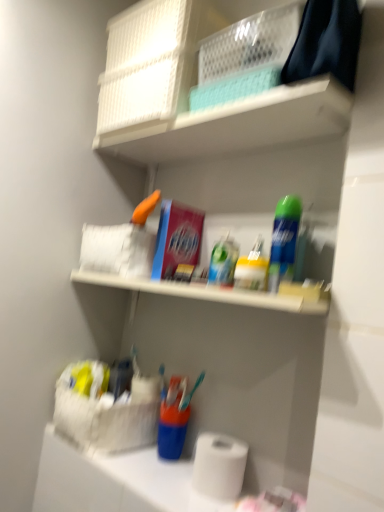
Question: Considering the relative sizes of white matte toilet paper at lower center and translucent plastic container at center, which is the second toiletry from left to right, in the image provided, is white matte toilet paper at lower center thinner than translucent plastic container at center, which is the second toiletry from left to right,?

Choices:
 (A) no
 (B) yes

Answer: (A)

Question: Can you confirm if white matte toilet paper at lower center is bigger than translucent plastic container at center, which is the second toiletry from left to right?

Choices:
 (A) yes
 (B) no

Answer: (A)

Question: Is white matte toilet paper at lower center next to translucent plastic container at center, which is the second toiletry from left to right?

Choices:
 (A) yes
 (B) no

Answer: (B)

Question: Is white matte toilet paper at lower center looking in the opposite direction of translucent plastic container at center, which is the second toiletry from left to right?

Choices:
 (A) yes
 (B) no

Answer: (B)

Question: Can you confirm if white matte toilet paper at lower center is positioned to the right of translucent plastic container at center, which is the second toiletry from left to right?

Choices:
 (A) no
 (B) yes

Answer: (A)

Question: Is white matte toilet paper at lower center smaller than translucent plastic container at center, which is the first toiletry in right-to-left order?

Choices:
 (A) yes
 (B) no

Answer: (B)

Question: Is white matte toilet paper at lower center a part of green matte spray can at upper right?

Choices:
 (A) no
 (B) yes

Answer: (A)

Question: Is green matte spray can at upper right looking in the opposite direction of white matte toilet paper at lower center?

Choices:
 (A) no
 (B) yes

Answer: (A)

Question: From a real-world perspective, is green matte spray can at upper right over white matte toilet paper at lower center?

Choices:
 (A) yes
 (B) no

Answer: (A)

Question: Is green matte spray can at upper right positioned beyond the bounds of white matte toilet paper at lower center?

Choices:
 (A) yes
 (B) no

Answer: (A)

Question: From the image's perspective, is green matte spray can at upper right below white matte toilet paper at lower center?

Choices:
 (A) yes
 (B) no

Answer: (B)

Question: Considering the relative sizes of green matte spray can at upper right and white matte toilet paper at lower center in the image provided, is green matte spray can at upper right smaller than white matte toilet paper at lower center?

Choices:
 (A) no
 (B) yes

Answer: (B)

Question: From the image's perspective, is translucent plastic toothpaste at center, which ranks as the second toiletry in right-to-left order, located beneath translucent plastic container at center, which is the first toiletry in right-to-left order?

Choices:
 (A) yes
 (B) no

Answer: (B)